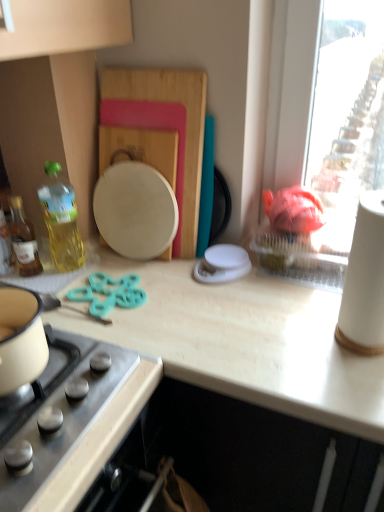
Find the location of a particular element. This screenshot has height=512, width=384. vacant area on the back side of translucent yellow bottle at left, the 1th bottle viewed from the right is located at coordinates (76, 250).